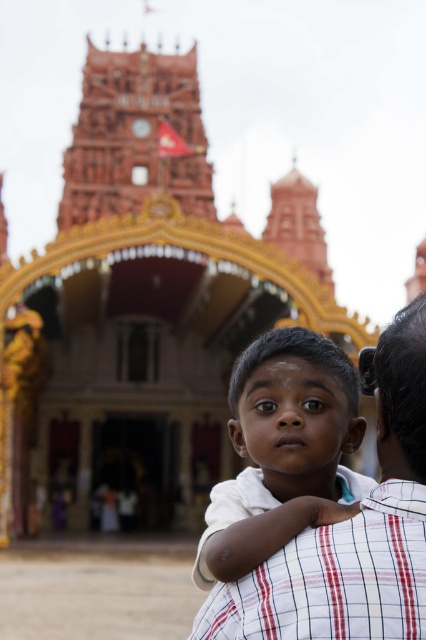
Question: Is white cotton shirt at center thinner than terracotta temple at upper center?

Choices:
 (A) yes
 (B) no

Answer: (A)

Question: In this image, where is white cotton shirt at center located relative to terracotta temple at upper center?

Choices:
 (A) left
 (B) right

Answer: (B)

Question: Which of the following is the farthest from the observer?

Choices:
 (A) (305, 481)
 (B) (163, 84)

Answer: (B)

Question: Which of the following is the closest to the observer?

Choices:
 (A) (167, 116)
 (B) (258, 360)

Answer: (B)

Question: Which point is closer to the camera taking this photo?

Choices:
 (A) [218, 520]
 (B) [140, 136]

Answer: (A)

Question: Is the position of white cotton shirt at center less distant than that of terracotta temple at upper center?

Choices:
 (A) no
 (B) yes

Answer: (B)